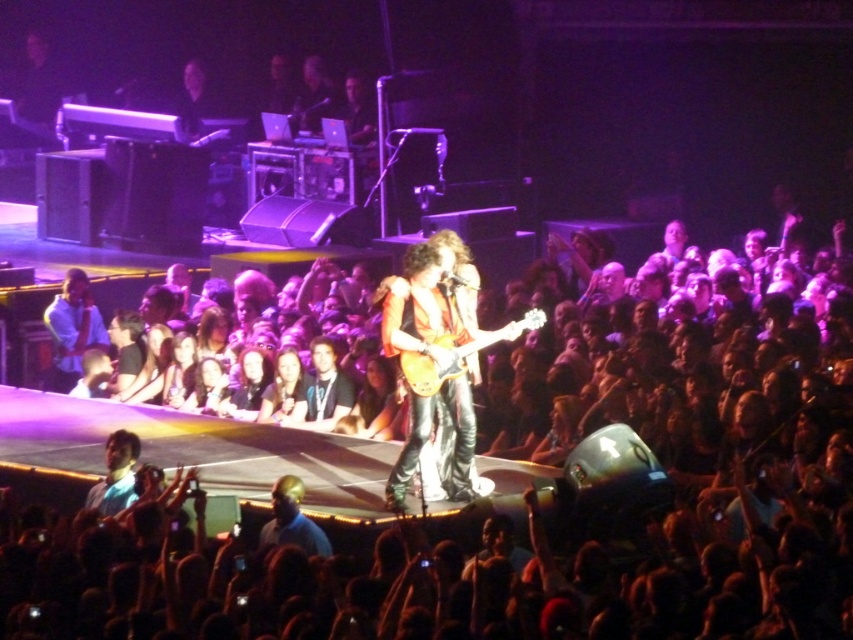
Does smooth skin crowd at center have a lesser width compared to glossy wood guitar at center?

In fact, smooth skin crowd at center might be wider than glossy wood guitar at center.

Does smooth skin crowd at center appear on the left side of glossy wood guitar at center?

No, smooth skin crowd at center is not to the left of glossy wood guitar at center.

What do you see at coordinates (463, 508) in the screenshot? Image resolution: width=853 pixels, height=640 pixels. I see `smooth skin crowd at center` at bounding box center [463, 508].

Locate an element on the screen. smooth skin crowd at center is located at coordinates (463, 508).